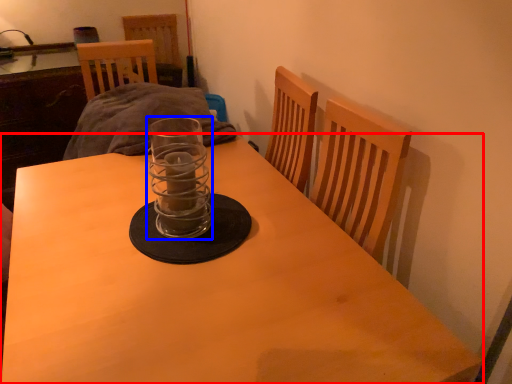
Question: Which object appears farthest to the camera in this image, table (highlighted by a red box) or candle holder (highlighted by a blue box)?

Choices:
 (A) table
 (B) candle holder

Answer: (B)